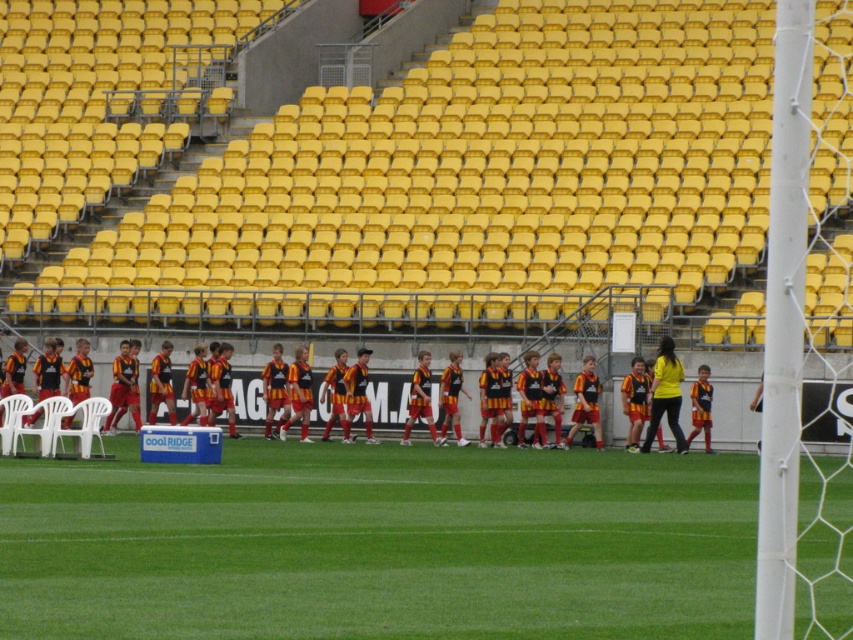
Question: Which of the following is the farthest from the observer?

Choices:
 (A) green grass at center
 (B) black jersey at center

Answer: (B)

Question: Among these objects, which one is nearest to the camera?

Choices:
 (A) green grass at center
 (B) black jersey at center

Answer: (A)

Question: Is green grass at center positioned at the back of black jersey at center?

Choices:
 (A) no
 (B) yes

Answer: (A)

Question: Can you confirm if green grass at center is positioned above black jersey at center?

Choices:
 (A) yes
 (B) no

Answer: (B)

Question: Can you confirm if green grass at center is positioned below black jersey at center?

Choices:
 (A) no
 (B) yes

Answer: (B)